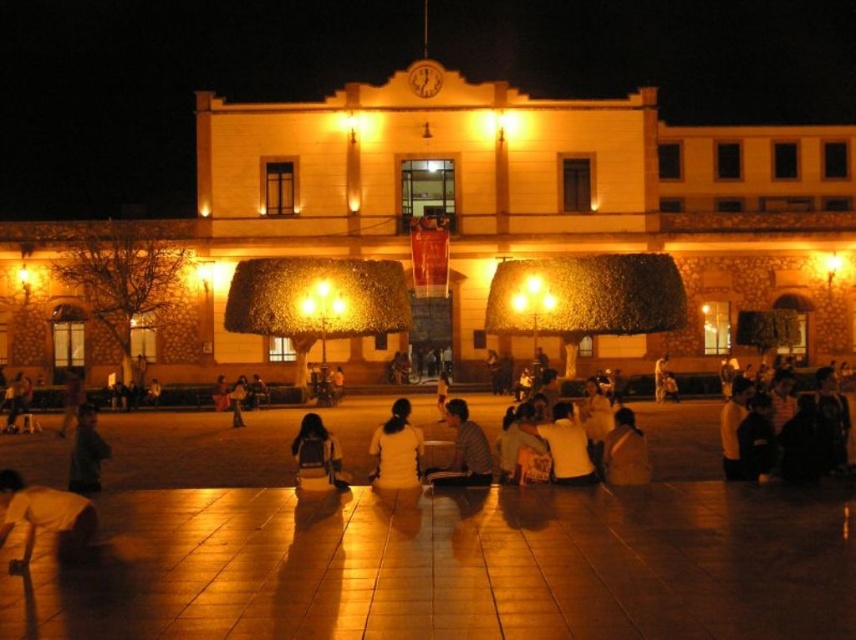
Question: Which point is closer to the camera?

Choices:
 (A) yellow cotton jacket at lower left
 (B) white shirt at center
 (C) white matte shirt at center
 (D) matte black backpack at center

Answer: (A)

Question: Considering the relative positions of yellow cotton jacket at lower left and light brown leather jacket at center in the image provided, where is yellow cotton jacket at lower left located with respect to light brown leather jacket at center?

Choices:
 (A) below
 (B) above

Answer: (A)

Question: From the image, what is the correct spatial relationship of yellow cotton jacket at lower left in relation to light brown leather jacket at lower right?

Choices:
 (A) below
 (B) above

Answer: (A)

Question: Which object appears farthest from the camera in this image?

Choices:
 (A) light brown leather jacket at lower right
 (B) white matte shirt at center
 (C) dark gray jacket at lower left
 (D) matte black jacket at center

Answer: (D)

Question: Can you confirm if yellow cotton jacket at lower left is positioned to the right of white matte shirt at center?

Choices:
 (A) yes
 (B) no

Answer: (B)

Question: Which of the following is the farthest from the observer?

Choices:
 (A) (574, 481)
 (B) (235, 396)
 (C) (605, 461)

Answer: (B)